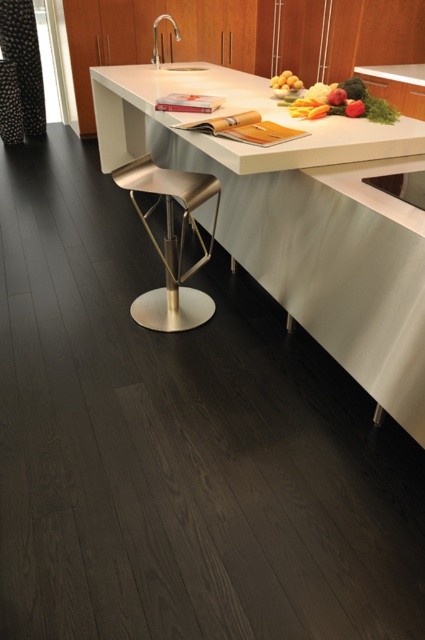
You are trying to place a rectangular cutting board on the white glossy countertop at center. Considering the yellow matte potatoes at upper center are already occupying space, can you determine if the countertop is wide enough for the cutting board?

The white glossy countertop at center is wider than the yellow matte potatoes at upper center, so it should have enough width to accommodate the cutting board.

You are standing in the kitchen and want to reach the black textured curtain at left without moving the white glossy countertop at center. Is the countertop blocking your path to the curtain?

The white glossy countertop at center is closer to the viewer than the black textured curtain at left, so it is blocking the path to the curtain.

You are standing in the modern kitchen and want to know where the black textured curtain at left is located. Can you describe its position relative to the other objects in the scene?

The black textured curtain at left is located at the left side of the scene, positioned at coordinates approximately 0.116 on the x and 0.047 on the y axis.